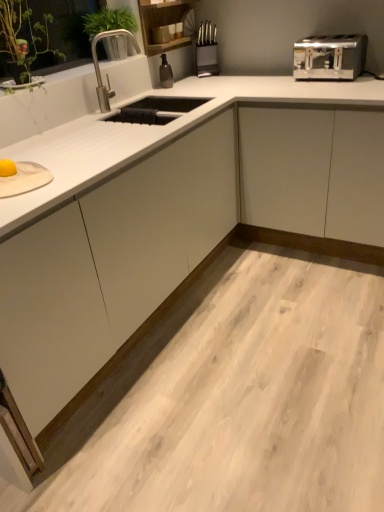
Question: Is satin silver toaster at upper right closer to the viewer compared to polished stainless steel faucet at upper left?

Choices:
 (A) no
 (B) yes

Answer: (A)

Question: From the image's perspective, does satin silver toaster at upper right appear lower than polished stainless steel faucet at upper left?

Choices:
 (A) yes
 (B) no

Answer: (B)

Question: Is the surface of satin silver toaster at upper right in direct contact with polished stainless steel faucet at upper left?

Choices:
 (A) yes
 (B) no

Answer: (B)

Question: Does satin silver toaster at upper right have a greater width compared to polished stainless steel faucet at upper left?

Choices:
 (A) no
 (B) yes

Answer: (B)

Question: Does satin silver toaster at upper right lie behind polished stainless steel faucet at upper left?

Choices:
 (A) no
 (B) yes

Answer: (B)

Question: Is polished stainless steel faucet at upper left in front of or behind satin silver toaster at upper right in the image?

Choices:
 (A) behind
 (B) front

Answer: (B)

Question: In terms of size, does polished stainless steel faucet at upper left appear bigger or smaller than satin silver toaster at upper right?

Choices:
 (A) small
 (B) big

Answer: (A)

Question: From the image's perspective, is polished stainless steel faucet at upper left positioned above or below satin silver toaster at upper right?

Choices:
 (A) above
 (B) below

Answer: (B)

Question: In the image, is polished stainless steel faucet at upper left on the left side or the right side of satin silver toaster at upper right?

Choices:
 (A) right
 (B) left

Answer: (B)

Question: From a real-world perspective, relative to polished stainless steel faucet at upper left, is satin silver toaster at upper right vertically above or below?

Choices:
 (A) below
 (B) above

Answer: (A)

Question: Considering the positions of satin silver toaster at upper right and polished stainless steel faucet at upper left in the image, is satin silver toaster at upper right bigger or smaller than polished stainless steel faucet at upper left?

Choices:
 (A) small
 (B) big

Answer: (B)

Question: Is satin silver toaster at upper right wider or thinner than polished stainless steel faucet at upper left?

Choices:
 (A) thin
 (B) wide

Answer: (B)

Question: Considering their positions, is satin silver toaster at upper right located in front of or behind polished stainless steel faucet at upper left?

Choices:
 (A) behind
 (B) front

Answer: (A)

Question: From the image's perspective, is green leafy plant at upper left located above or below polished stainless steel faucet at upper left?

Choices:
 (A) below
 (B) above

Answer: (B)

Question: Considering the positions of point (97, 29) and point (105, 32), is point (97, 29) closer or farther from the camera than point (105, 32)?

Choices:
 (A) closer
 (B) farther

Answer: (B)